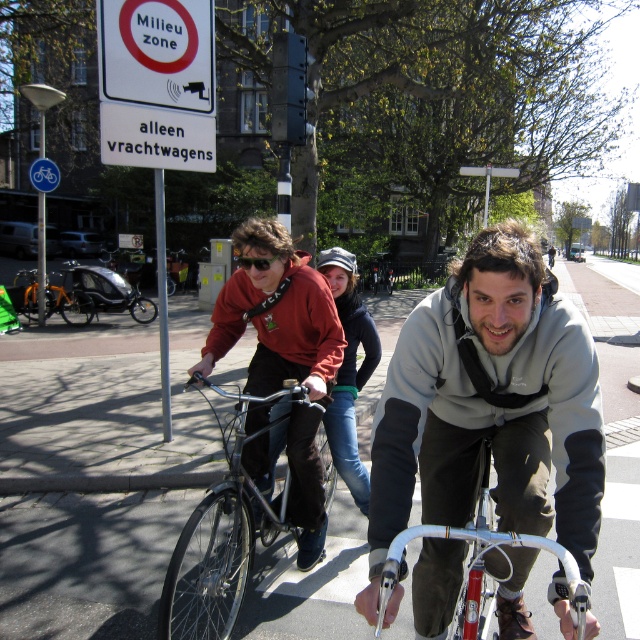
Looking at this image, is gray fleece jacket at center bigger than orange matte bicycle at center?

No.

Who is shorter, gray fleece jacket at center or orange matte bicycle at center?

With less height is gray fleece jacket at center.

The width and height of the screenshot is (640, 640). What are the coordinates of `gray fleece jacket at center` in the screenshot? It's located at (490, 404).

The image size is (640, 640). In order to click on gray fleece jacket at center in this screenshot , I will do `click(490, 404)`.

Consider the image. Is the position of matte black jacket at center more distant than that of silver metallic bicycle at center?

Yes, matte black jacket at center is behind silver metallic bicycle at center.

What are the coordinates of `matte black jacket at center` in the screenshot? It's located at (275, 314).

Find the location of `matte black jacket at center`. matte black jacket at center is located at coordinates (275, 314).

Is gray fleece jacket at center shorter than blue plastic bicycle at upper left?

In fact, gray fleece jacket at center may be taller than blue plastic bicycle at upper left.

Which is more to the right, gray fleece jacket at center or blue plastic bicycle at upper left?

Positioned to the right is gray fleece jacket at center.

Measure the distance between point (x=582, y=561) and camera.

They are 5.68 feet apart.

Locate an element on the screen. This screenshot has height=640, width=640. gray fleece jacket at center is located at coordinates (490, 404).